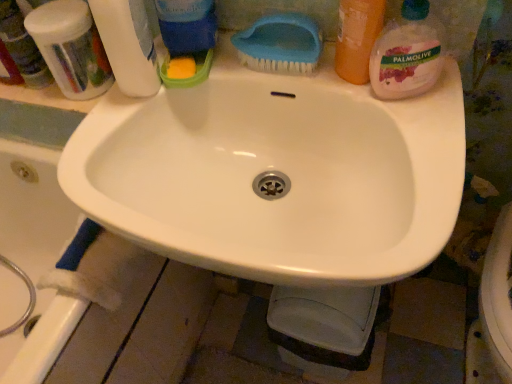
At what (x,y) coordinates should I click in order to perform the action: click on unoccupied area in front of blue plastic brush at upper center. Please return your answer as a coordinate pair (x, y). The height and width of the screenshot is (384, 512). Looking at the image, I should click on (338, 102).